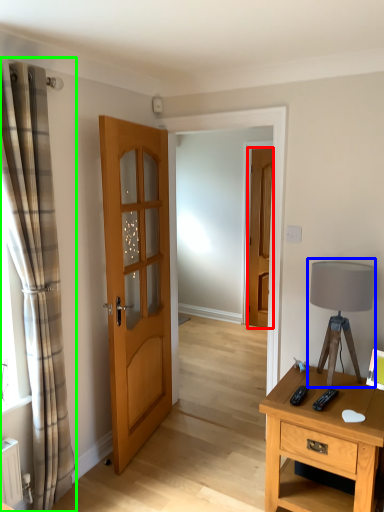
Question: Estimate the real-world distances between objects in this image. Which object is farther from door (highlighted by a red box), table lamp (highlighted by a blue box) or curtain (highlighted by a green box)?

Choices:
 (A) table lamp
 (B) curtain

Answer: (B)